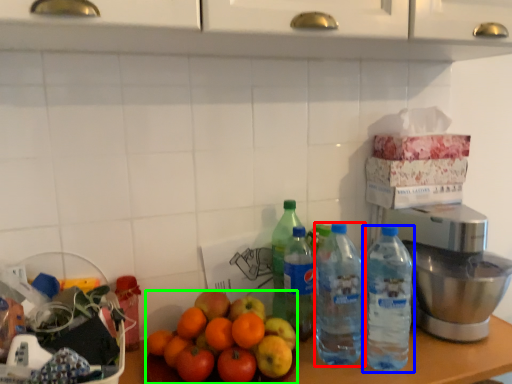
Question: Which object is the farthest from bottle (highlighted by a red box)? Choose among these: bottle (highlighted by a blue box) or orange (highlighted by a green box).

Choices:
 (A) bottle
 (B) orange

Answer: (B)